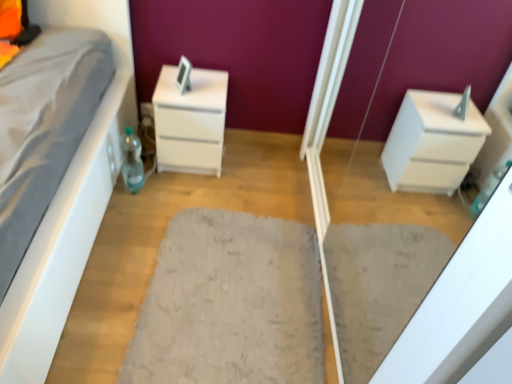
Locate an element on the screen. The height and width of the screenshot is (384, 512). vacant space behind gray fluffy rug at center is located at coordinates (242, 187).